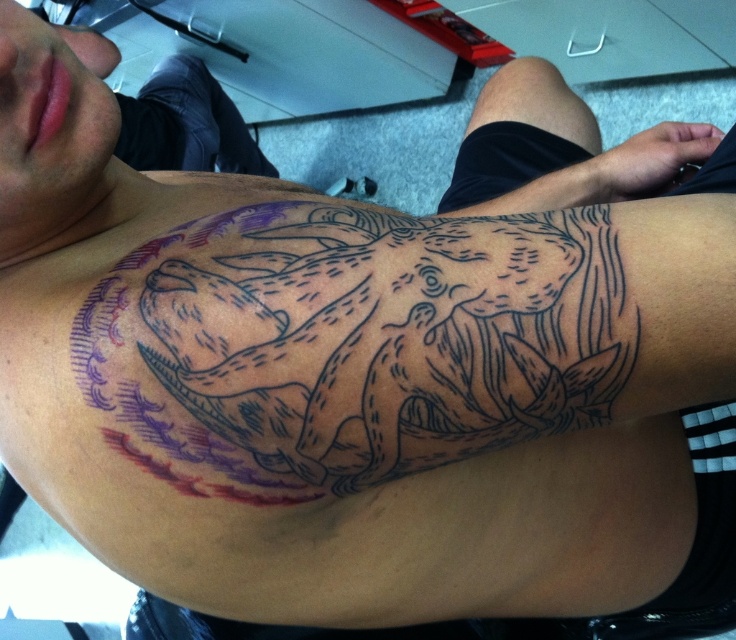
Between black ink tattoo at upper center and black ink tattoo at upper right, which one appears on the left side from the viewer's perspective?

Positioned to the left is black ink tattoo at upper center.

This screenshot has height=640, width=736. In order to click on black ink tattoo at upper center in this screenshot , I will do pos(378,340).